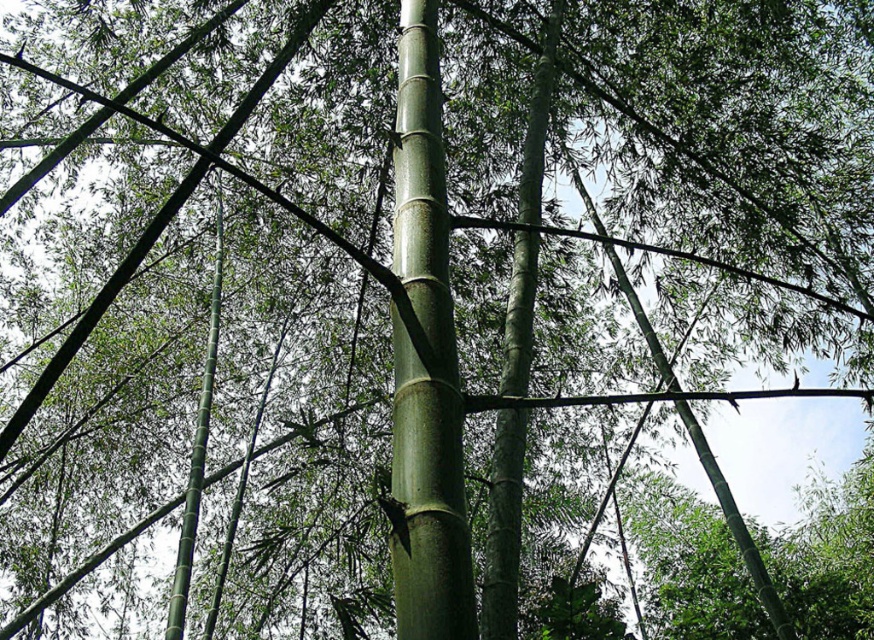
Can you confirm if green matte bamboo at center is shorter than green smooth bamboo at center?

Yes, green matte bamboo at center is shorter than green smooth bamboo at center.

Which of these two, green matte bamboo at center or green smooth bamboo at center, stands taller?

green smooth bamboo at center is taller.

Between point (399, 116) and point (186, 540), which one is positioned in front?

Positioned in front is point (399, 116).

Image resolution: width=874 pixels, height=640 pixels. In order to click on green matte bamboo at center in this screenshot , I will do `click(425, 360)`.